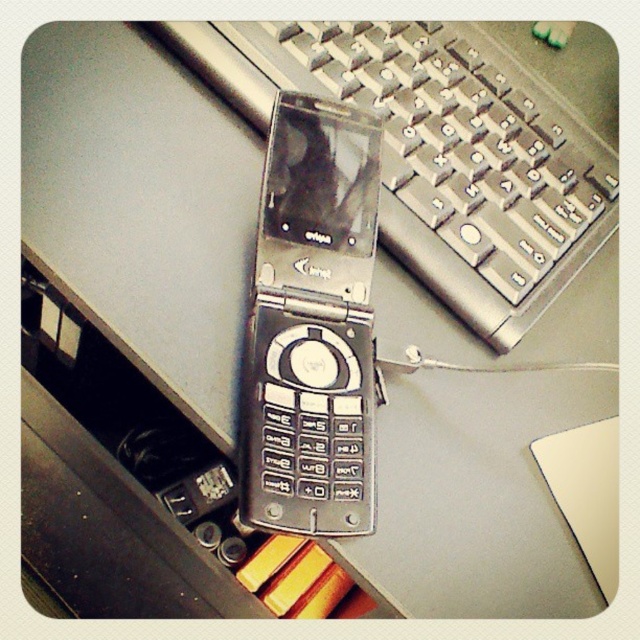
Question: Which point appears closest to the camera in this image?

Choices:
 (A) (600, 220)
 (B) (314, 394)

Answer: (B)

Question: Is silver metallic keyboard at upper center above silver metallic flip phone at center?

Choices:
 (A) yes
 (B) no

Answer: (A)

Question: Among these points, which one is farthest from the camera?

Choices:
 (A) (198, 38)
 (B) (268, 486)

Answer: (A)

Question: Where is silver metallic keyboard at upper center located in relation to silver metallic flip phone at center in the image?

Choices:
 (A) above
 (B) below

Answer: (A)

Question: Can you confirm if silver metallic keyboard at upper center is positioned to the left of silver metallic flip phone at center?

Choices:
 (A) yes
 (B) no

Answer: (B)